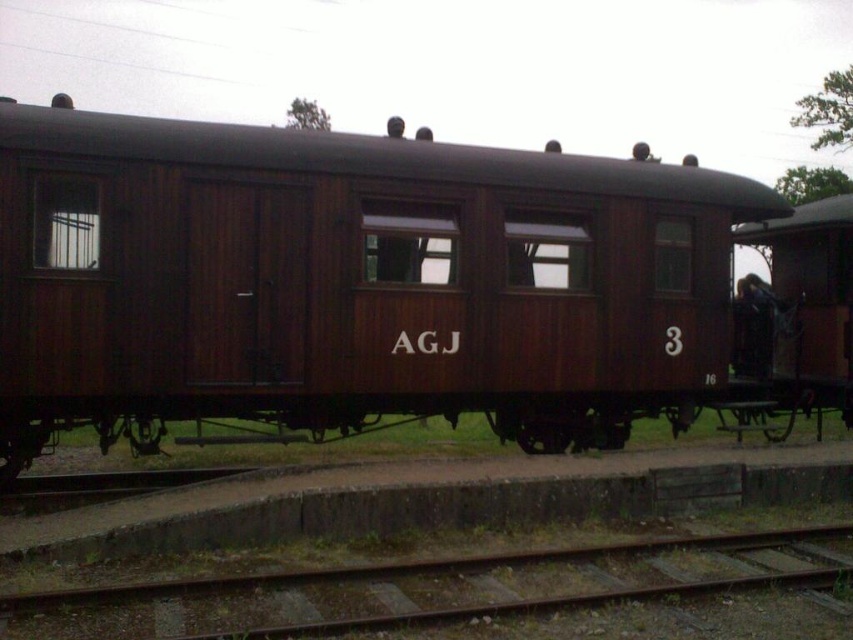
Who is higher up, wooden train car at center or rusty metal train track at lower center?

Positioned higher is wooden train car at center.

What do you see at coordinates (363, 284) in the screenshot?
I see `wooden train car at center` at bounding box center [363, 284].

Where is `wooden train car at center`? wooden train car at center is located at coordinates (363, 284).